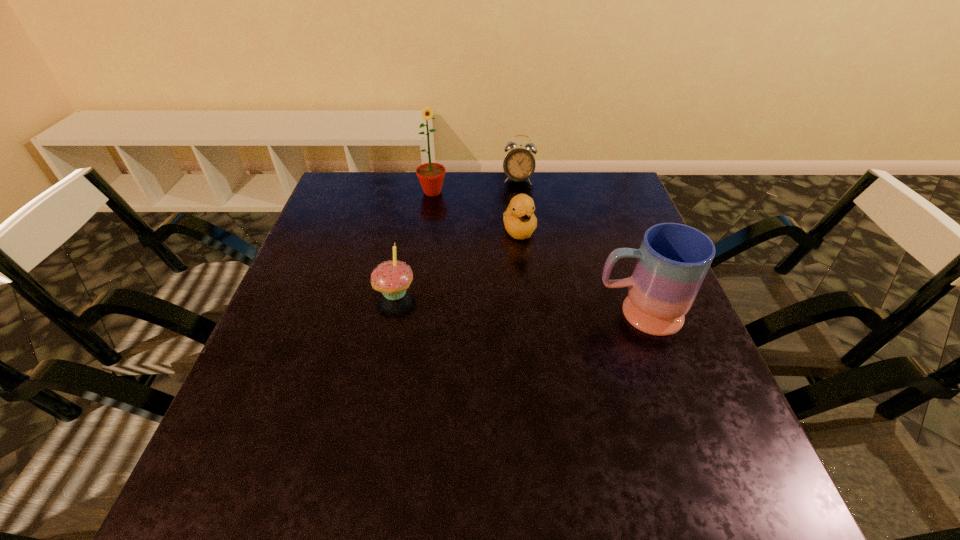
In order to click on empty space that is in between the rightmost object and the cupcake in this screenshot , I will do `click(516, 303)`.

I want to click on free space between the rightmost object and the alarm clock, so click(578, 247).

Locate an element on the screen. Image resolution: width=960 pixels, height=540 pixels. free point between the third nearest object and the rightmost object is located at coordinates (579, 272).

I want to click on free point between the cupcake and the alarm clock, so click(x=457, y=237).

Identify the location of vacant area between the duckling and the tallest object. This screenshot has width=960, height=540. (476, 211).

Where is `free space between the sunflower and the mug`? free space between the sunflower and the mug is located at coordinates (535, 253).

Locate an element on the screen. The width and height of the screenshot is (960, 540). empty location between the sunflower and the third farthest object is located at coordinates click(x=476, y=211).

Find the location of a particular element. The width and height of the screenshot is (960, 540). free space between the cupcake and the tallest object is located at coordinates (414, 242).

Locate which object ranks fourth in proximity to the rightmost object. Please provide its 2D coordinates. Your answer should be formatted as a tuple, i.e. [(x, y)], where the tuple contains the x and y coordinates of a point satisfying the conditions above.

[(431, 175)]

You are a GUI agent. You are given a task and a screenshot of the screen. Output one action in this format:
    pyautogui.click(x=<x>, y=<y>)
    Task: Click on the object identified as the closest to the second tallest object
    The height and width of the screenshot is (540, 960).
    Given the screenshot: What is the action you would take?
    pyautogui.click(x=519, y=219)